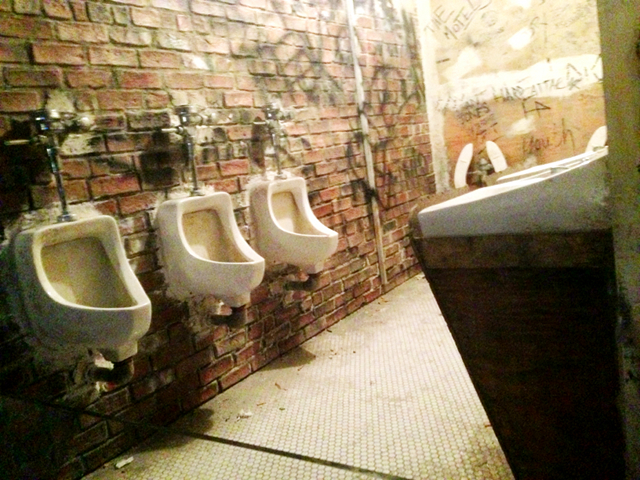
At what (x,y) coordinates should I click in order to perform the action: click on brick wall. Please return your answer as a coordinate pair (x, y). Looking at the image, I should click on (269, 91).